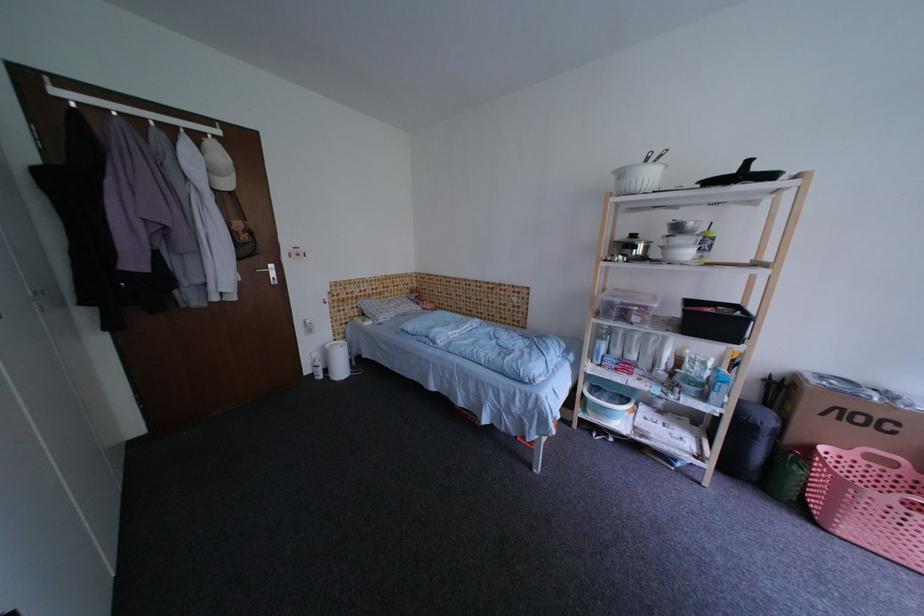
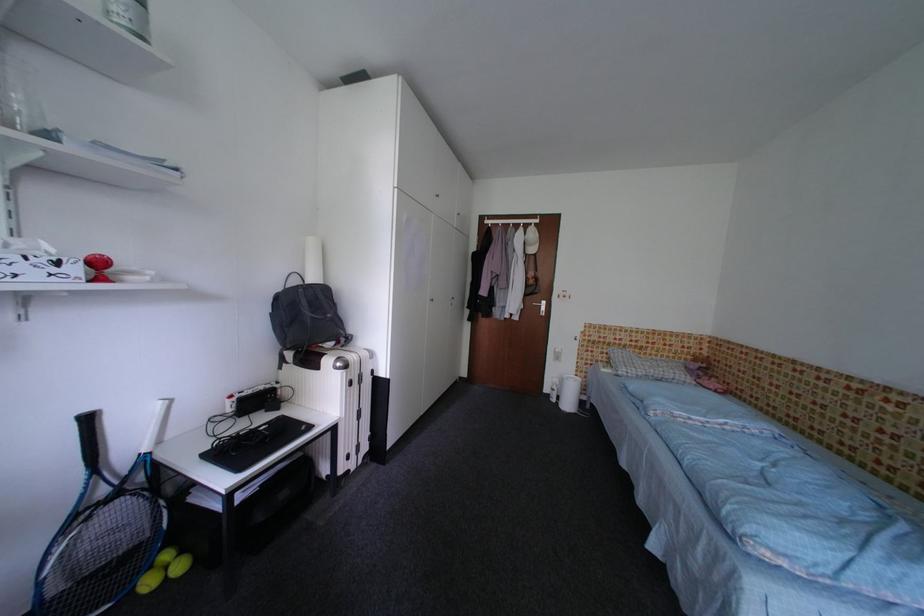
Question: I am providing you with two images of the same scene from different viewpoints. Please identify which objects are invisible in image2.

Choices:
 (A) yellow tennis ball
 (B) black backpack
 (C) white cap
 (D) none of these

Answer: (D)